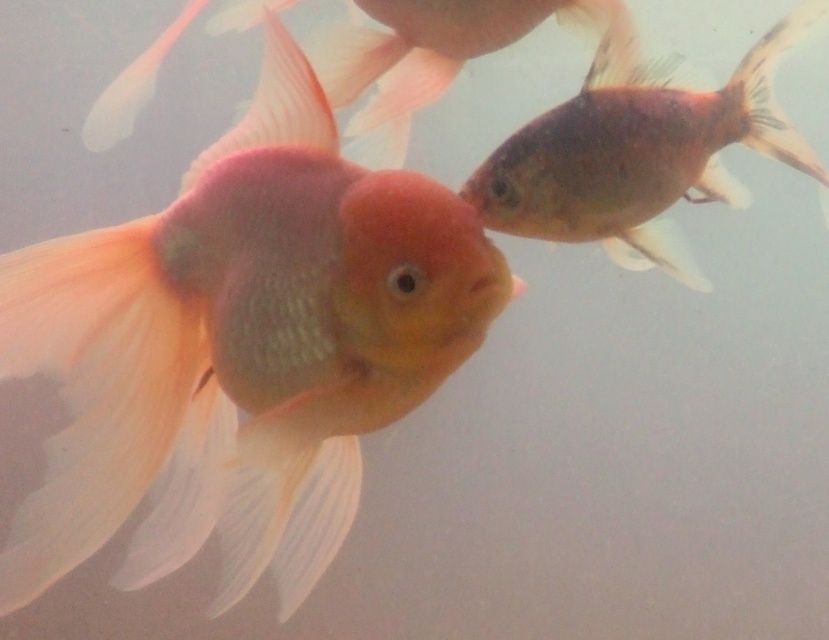
You are an underwater photographer aiming to capture the matte goldfish at left. Based on its coordinates, where should you position your camera to ensure it is centered in your shot?

The matte goldfish at left is located at coordinates point (240,348), so you should position your camera directly facing that point to center it in your shot.

You are a marine biologist observing two fish underwater. You have a net that can reach up to 15 inches. The scene shows a matte goldfish at left and a shiny metallic fish at upper right. Can you capture both fish with a single cast of your net?

The matte goldfish at left is 13.86 inches away from the shiny metallic fish at upper right. Since the distance between them is less than the net range of 15 inches, yes, you can capture both fish with a single cast of the net.